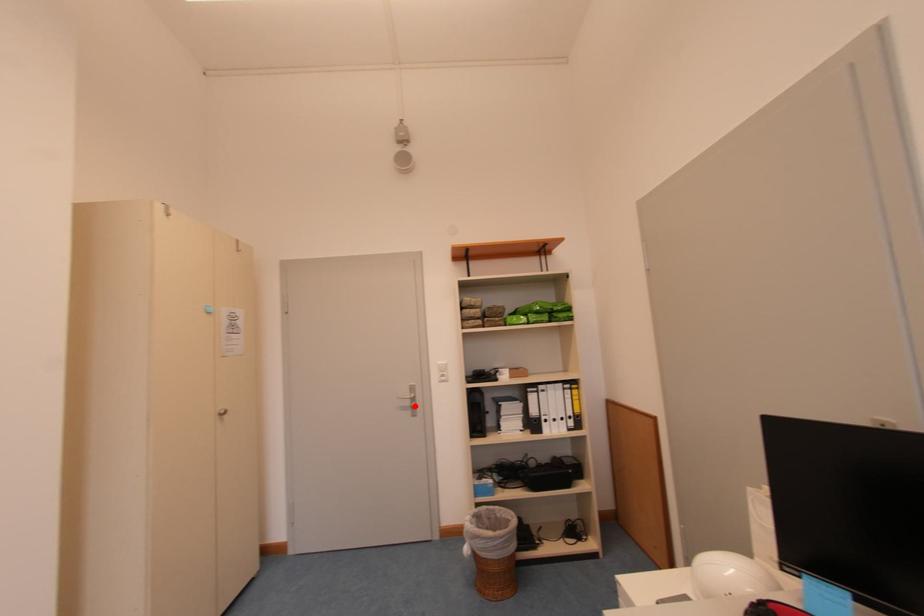
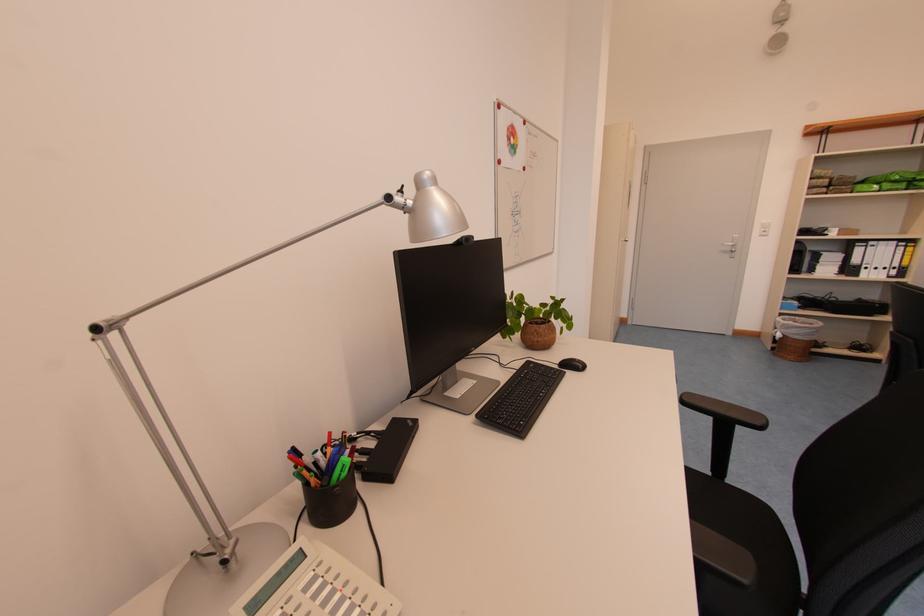
The point at the highlighted location is marked in the first image. Where is the corresponding point in the second image?

(736, 252)